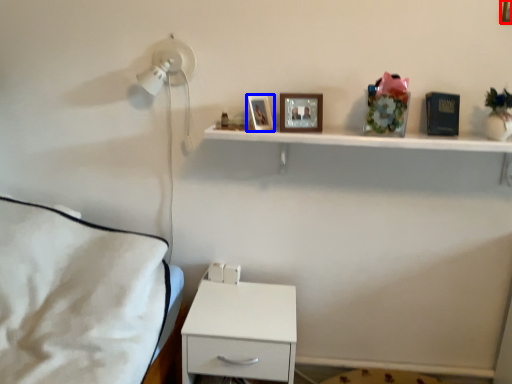
Question: Among these objects, which one is nearest to the camera, picture frame (highlighted by a red box) or picture frame (highlighted by a blue box)?

Choices:
 (A) picture frame
 (B) picture frame

Answer: (A)